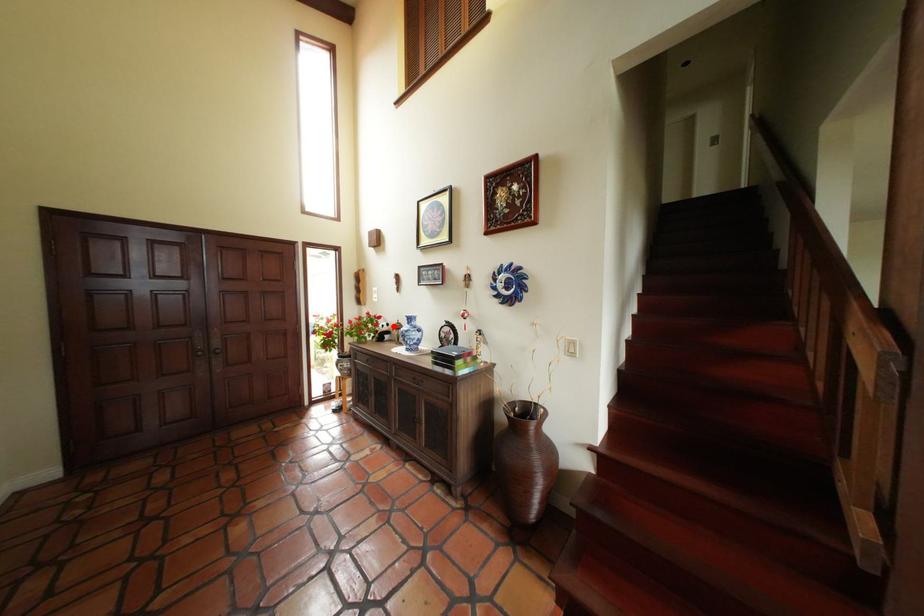
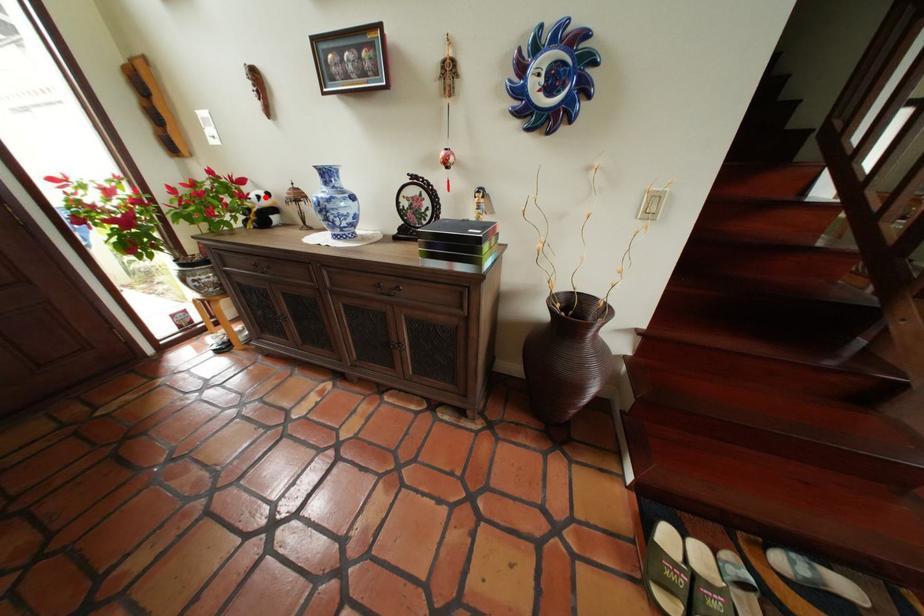
I am providing you with two images of the same scene from different viewpoints. A red point is marked on the first image and another point is marked on the second image. Is the red point in image1 aligned with the point shown in image2?

Yes